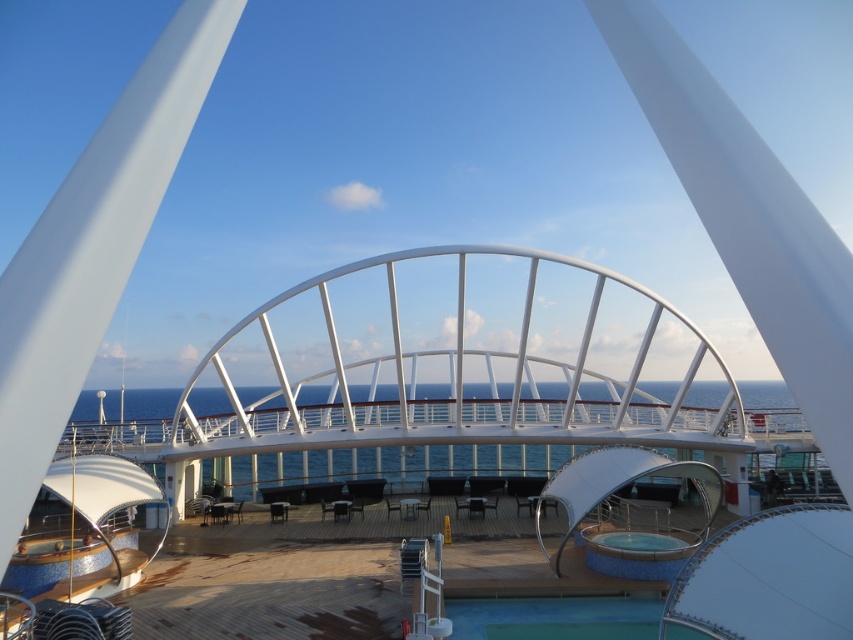
In the scene shown: You are standing at the viewer position on the cruise ship deck. There is a point marked at coordinates point [657,604]. Can you reach that point without moving more than 15 meters from your current position?

The point [657,604] is 14.58 meters away from the viewer, so yes, you can reach it without exceeding the 15 meter limit.

You are standing at point 0.5, 0.5 on the cruise ship deck. You want to go to the green rubber pool at lower center. Which direction should you move? Please answer with either north, south, east, or west.

You should move south to reach the green rubber pool at lower center because it is located at point (554, 618), which is lower than your current position at (426, 320). In coordinate systems, lower y values are south and higher y values are north. Since 0.651 is higher than 0.5, the pool is north of you, so you need to move north.